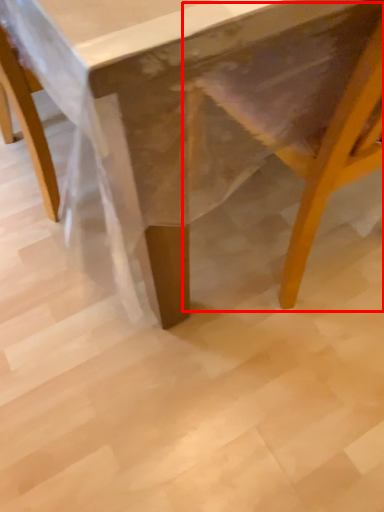
Question: From the image's perspective, considering the relative positions of swivel chair (annotated by the red box) and table in the image provided, where is swivel chair (annotated by the red box) located with respect to the staircase?

Choices:
 (A) above
 (B) below

Answer: (B)